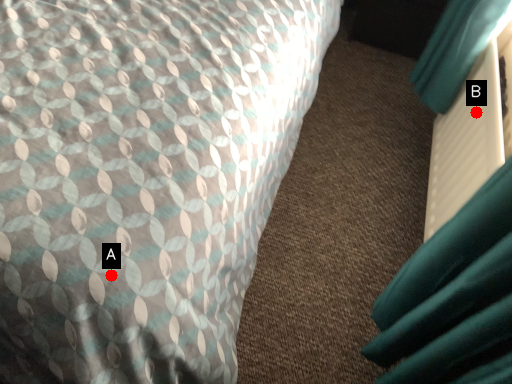
Question: Two points are circled on the image, labeled by A and B beside each circle. Which point is closer to the camera?

Choices:
 (A) A is closer
 (B) B is closer

Answer: (A)